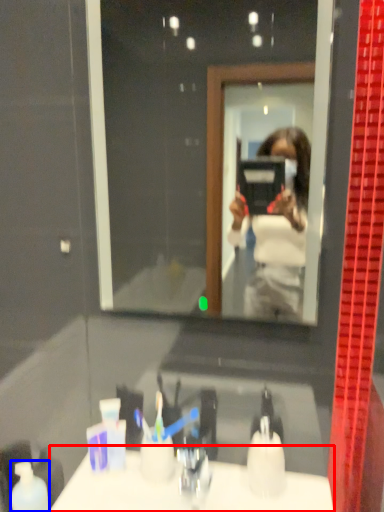
Question: Which of the following is the closest to the observer, counter top (highlighted by a red box) or mouthwash (highlighted by a blue box)?

Choices:
 (A) counter top
 (B) mouthwash

Answer: (A)